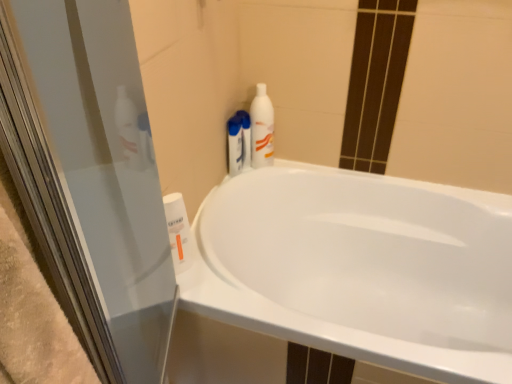
Question: From a real-world perspective, is white glossy bottle at lower left, which is the 1th cleaning product in front-to-back order, above or below white glossy bottle at upper right, which appears as the 1th cleaning product when viewed from the top?

Choices:
 (A) above
 (B) below

Answer: (B)

Question: Relative to white glossy bottle at upper right, which is the second cleaning product from front to back, is white glossy bottle at lower left, the third cleaning product positioned from the back, in front or behind?

Choices:
 (A) front
 (B) behind

Answer: (A)

Question: Which of these objects is positioned closest to the white glossy bathtub at center?

Choices:
 (A) white glossy bottle at upper right, which appears as the 1th cleaning product when viewed from the top
 (B) white glossy bottle at lower left, the third cleaning product positioned from the back
 (C) white glossy bottle at upper right, arranged as the second cleaning product when viewed from the left

Answer: (A)

Question: Estimate the real-world distances between objects in this image. Which object is closer to the white glossy bottle at lower left, the third cleaning product when ordered from right to left?

Choices:
 (A) white glossy bottle at upper right, the first cleaning product viewed from the right
 (B) white glossy bathtub at center
 (C) white glossy bottle at upper right, positioned as the 2th cleaning product in bottom-to-top order

Answer: (C)